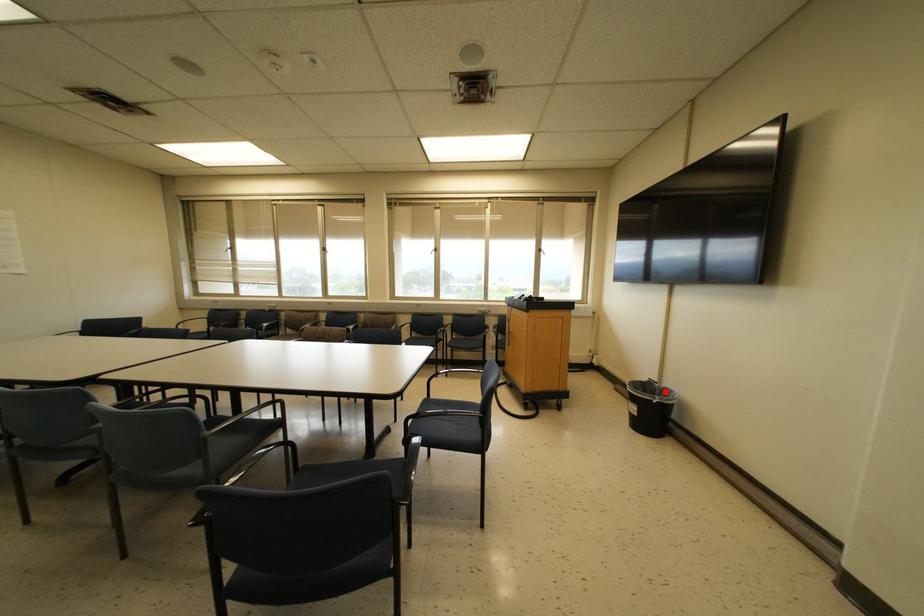
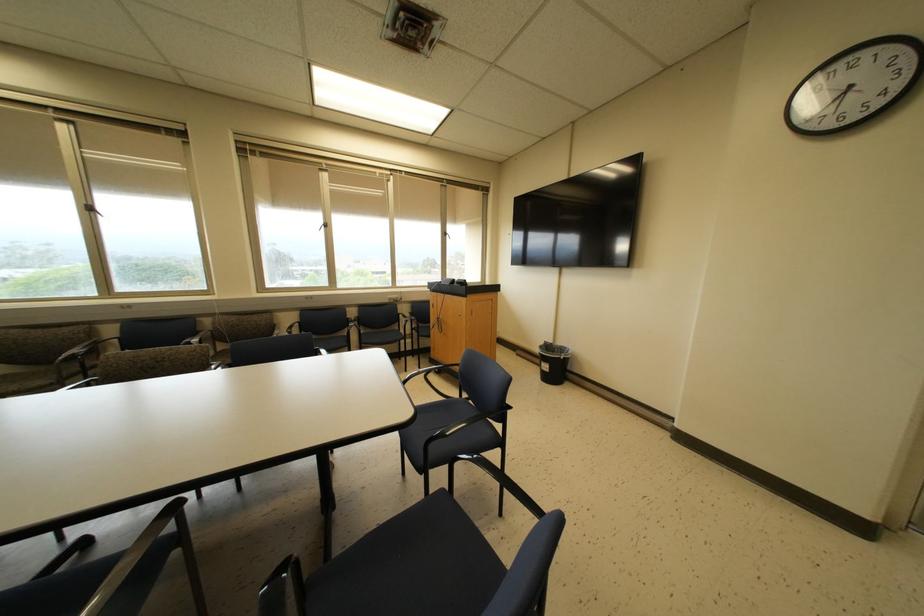
In the second image, find the point that corresponds to the highlighted location in the first image.

(562, 349)